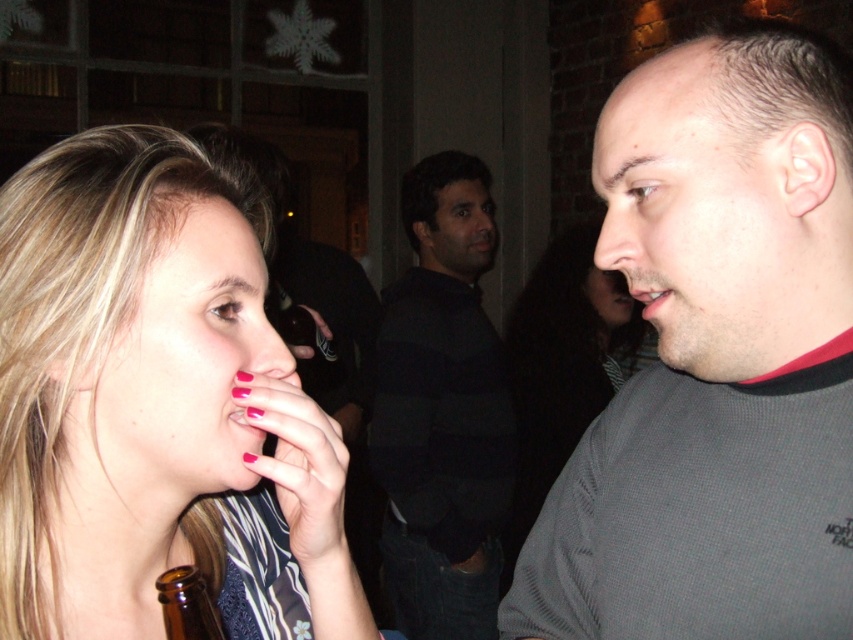
Based on the scene description, can you determine which object is taller between the smooth skin face at center and the matte black nose at center?

The smooth skin face at center is much taller than the matte black nose at center.

You are a photographer trying to capture a closeup of the matte pink nose at center and the pink glossy lips at center. Which object should you focus on first to ensure it appears sharp in the photo?

You should focus on the matte pink nose at center first because it is closer to the viewer than the pink glossy lips at center, so focusing on it will ensure it appears sharp while the lips may be slightly out of focus.